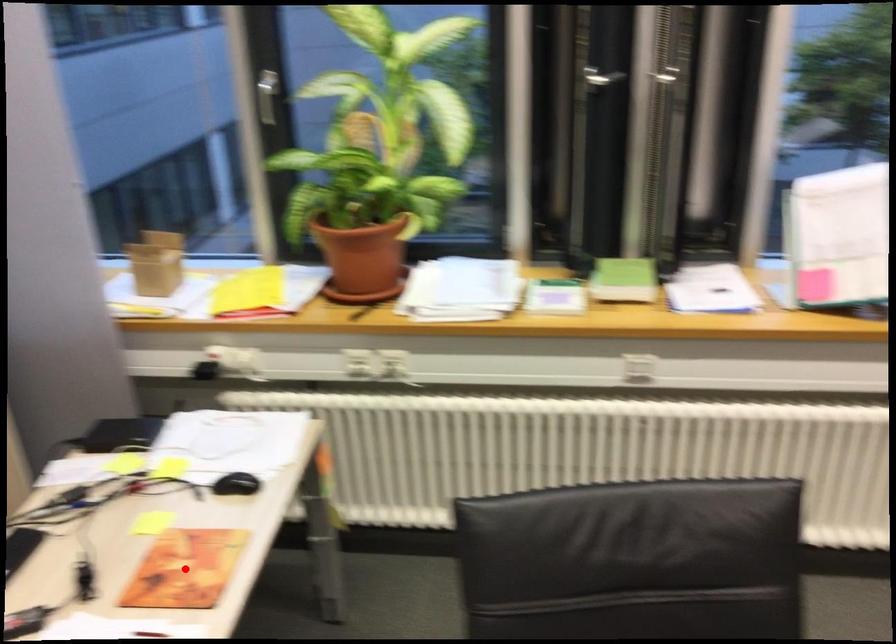
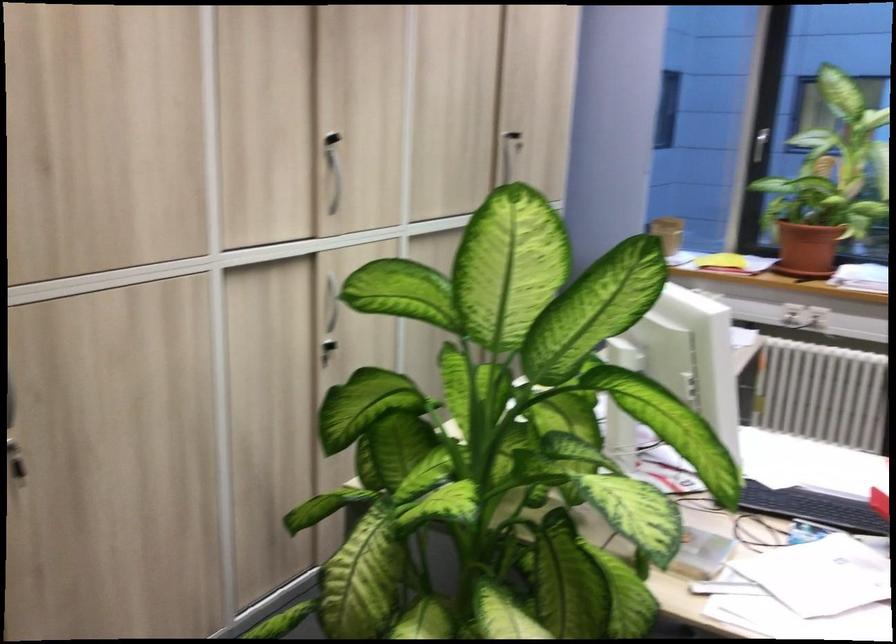
Question: I am providing you with two images of the same scene from different viewpoints. A red point is marked on the first image. Is the red point's position out of view in image 2?

Choices:
 (A) Yes
 (B) No

Answer: (A)